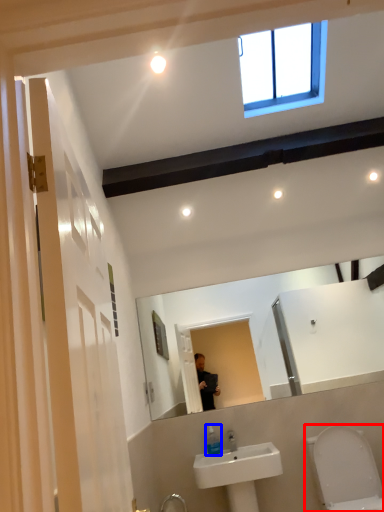
Question: Which of the following is the closest to the observer, toilet (highlighted by a red box) or soap dispenser (highlighted by a blue box)?

Choices:
 (A) toilet
 (B) soap dispenser

Answer: (A)